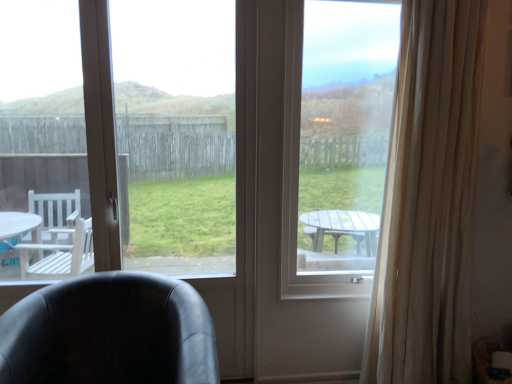
Question: Is transparent glass window at center, placed as the second window screen when sorted from right to left, not near beige sheer curtain at right?

Choices:
 (A) no
 (B) yes

Answer: (B)

Question: Can you confirm if transparent glass window at center, which ranks as the 1th window screen in left-to-right order, is smaller than beige sheer curtain at right?

Choices:
 (A) yes
 (B) no

Answer: (A)

Question: Considering the relative sizes of transparent glass window at center, placed as the second window screen when sorted from right to left, and beige sheer curtain at right in the image provided, is transparent glass window at center, placed as the second window screen when sorted from right to left, thinner than beige sheer curtain at right?

Choices:
 (A) no
 (B) yes

Answer: (B)

Question: Could you tell me if transparent glass window at center, which ranks as the 1th window screen in left-to-right order, is turned towards beige sheer curtain at right?

Choices:
 (A) no
 (B) yes

Answer: (A)

Question: Is transparent glass window at center, placed as the second window screen when sorted from right to left, placed right next to beige sheer curtain at right?

Choices:
 (A) no
 (B) yes

Answer: (A)

Question: Can you confirm if transparent glass window at center, which ranks as the 1th window screen in left-to-right order, is wider than beige sheer curtain at right?

Choices:
 (A) yes
 (B) no

Answer: (B)

Question: From the image's perspective, is transparent glass window at center, which ranks as the 1th window screen in left-to-right order, on transparent glass window at center, the first window screen from the right?

Choices:
 (A) no
 (B) yes

Answer: (A)

Question: Is transparent glass window at center, placed as the second window screen when sorted from right to left, at the left side of transparent glass window at center, the first window screen from the right?

Choices:
 (A) no
 (B) yes

Answer: (B)

Question: From the image's perspective, is transparent glass window at center, which ranks as the 1th window screen in left-to-right order, beneath transparent glass window at center, the 2th window screen in the left-to-right sequence?

Choices:
 (A) no
 (B) yes

Answer: (B)

Question: Considering the relative sizes of transparent glass window at center, placed as the second window screen when sorted from right to left, and transparent glass window at center, the first window screen from the right, in the image provided, is transparent glass window at center, placed as the second window screen when sorted from right to left, smaller than transparent glass window at center, the first window screen from the right,?

Choices:
 (A) no
 (B) yes

Answer: (A)

Question: Is transparent glass window at center, the 2th window screen in the left-to-right sequence, at the back of transparent glass window at center, placed as the second window screen when sorted from right to left?

Choices:
 (A) yes
 (B) no

Answer: (B)

Question: From a real-world perspective, is transparent glass window at center, which ranks as the 1th window screen in left-to-right order, beneath transparent glass window at center, the first window screen from the right?

Choices:
 (A) yes
 (B) no

Answer: (A)

Question: Is black leather chair at lower left turned away from transparent glass window at center, which ranks as the 1th window screen in left-to-right order?

Choices:
 (A) no
 (B) yes

Answer: (B)